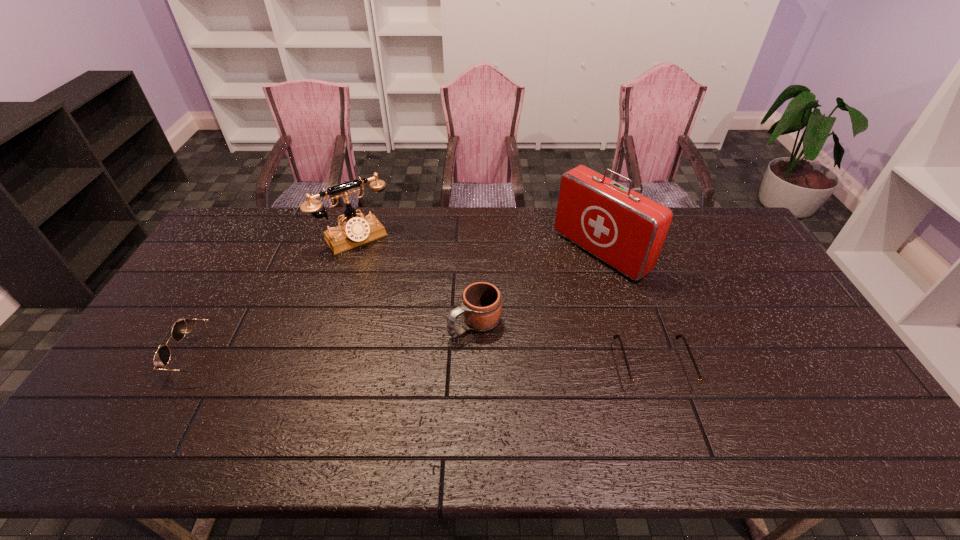
What are the coordinates of `vacant area situated on the side of the tallest object with the first aid cross symbol` in the screenshot? It's located at point(536,298).

At what (x,y) coordinates should I click in order to perform the action: click on vacant position located 0.060m on the side of the tallest object with the first aid cross symbol. Please return your answer as a coordinate pair (x, y). This screenshot has width=960, height=540. Looking at the image, I should click on (560, 282).

This screenshot has width=960, height=540. Find the location of `free region located 0.330m on the side of the tallest object with the first aid cross symbol`. free region located 0.330m on the side of the tallest object with the first aid cross symbol is located at coordinates [x=496, y=324].

What are the coordinates of `vacant space situated 0.140m on the side of the third object from left to right with the handle` in the screenshot? It's located at (413, 363).

Locate an element on the screen. This screenshot has width=960, height=540. vacant space located on the side of the third object from left to right with the handle is located at coordinates (384, 382).

Where is `free spot located on the side of the third object from left to right with the handle`? Image resolution: width=960 pixels, height=540 pixels. free spot located on the side of the third object from left to right with the handle is located at coordinates (425, 355).

You are a GUI agent. You are given a task and a screenshot of the screen. Output one action in this format:
    pyautogui.click(x=<x>, y=<y>)
    Task: Click on the vacant space located 0.180m on the dial of the fourth object from right to left
    
    Given the screenshot: What is the action you would take?
    pyautogui.click(x=393, y=283)

Locate an element on the screen. The width and height of the screenshot is (960, 540). vacant area located on the dial of the fourth object from right to left is located at coordinates (x=413, y=310).

The height and width of the screenshot is (540, 960). In order to click on vacant space located 0.230m on the dial of the fourth object from right to left in this screenshot , I will do `click(399, 292)`.

The image size is (960, 540). I want to click on the first-aid kit at the far edge, so click(625, 229).